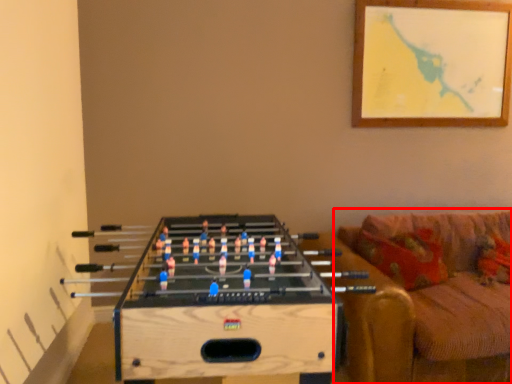
Question: Observing the image, what is the correct spatial positioning of studio couch (annotated by the red box) in reference to table?

Choices:
 (A) left
 (B) right

Answer: (B)